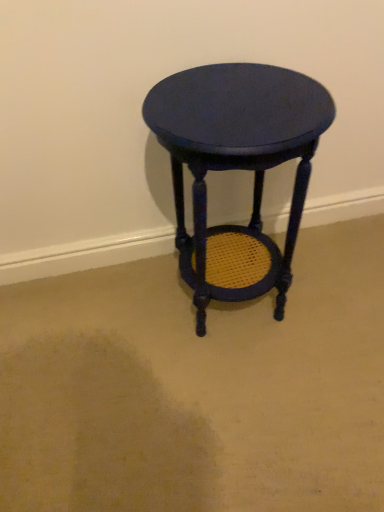
What do you see at coordinates (237, 168) in the screenshot?
I see `matte black stool at center` at bounding box center [237, 168].

Where is `matte black stool at center`? matte black stool at center is located at coordinates (237, 168).

The image size is (384, 512). Identify the location of matte black stool at center. (237, 168).